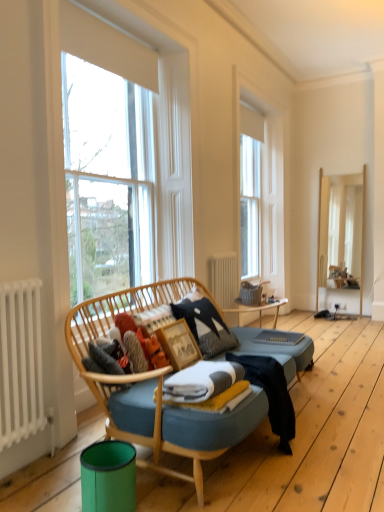
Question: Is the depth of fluffy orange plush at center greater than that of fluffy fabric laundry at center?

Choices:
 (A) no
 (B) yes

Answer: (B)

Question: Does fluffy orange plush at center have a greater height compared to fluffy fabric laundry at center?

Choices:
 (A) yes
 (B) no

Answer: (B)

Question: Can you confirm if fluffy orange plush at center is shorter than fluffy fabric laundry at center?

Choices:
 (A) no
 (B) yes

Answer: (B)

Question: Are fluffy orange plush at center and fluffy fabric laundry at center located far from each other?

Choices:
 (A) yes
 (B) no

Answer: (B)

Question: Does fluffy orange plush at center have a larger size compared to fluffy fabric laundry at center?

Choices:
 (A) no
 (B) yes

Answer: (A)

Question: Is fluffy fabric laundry at center bigger or smaller than clear glass window at left?

Choices:
 (A) small
 (B) big

Answer: (A)

Question: Is point (140, 333) closer or farther from the camera than point (148, 257)?

Choices:
 (A) farther
 (B) closer

Answer: (B)

Question: From the image's perspective, is fluffy fabric laundry at center located above or below clear glass window at left?

Choices:
 (A) above
 (B) below

Answer: (B)

Question: In the image, is fluffy fabric laundry at center on the left side or the right side of clear glass window at left?

Choices:
 (A) left
 (B) right

Answer: (A)

Question: From the image's perspective, relative to fluffy fabric laundry at center, is white wood window frame at upper center above or below?

Choices:
 (A) above
 (B) below

Answer: (A)

Question: Looking at their shapes, would you say white wood window frame at upper center is wider or thinner than fluffy fabric laundry at center?

Choices:
 (A) thin
 (B) wide

Answer: (A)

Question: Is point (243, 131) positioned closer to the camera than point (102, 353)?

Choices:
 (A) closer
 (B) farther

Answer: (B)

Question: In terms of height, does white wood window frame at upper center look taller or shorter compared to fluffy fabric laundry at center?

Choices:
 (A) short
 (B) tall

Answer: (B)

Question: Relative to clear glass window at left, is wooden picture frame at center in front or behind?

Choices:
 (A) behind
 (B) front

Answer: (A)

Question: From their relative heights in the image, would you say wooden picture frame at center is taller or shorter than clear glass window at left?

Choices:
 (A) short
 (B) tall

Answer: (A)